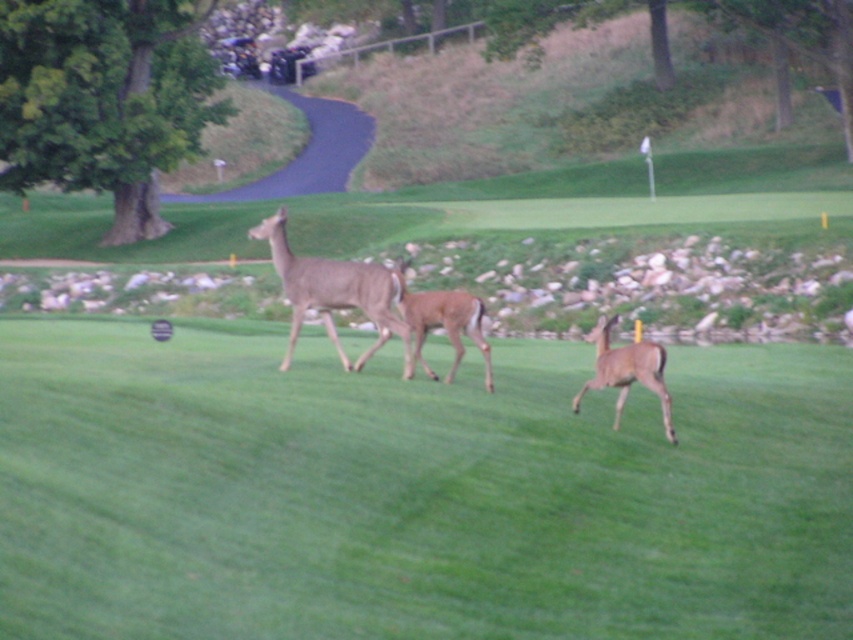
Between green grass at center and brown matte deer at center, which one is positioned lower?

green grass at center

This screenshot has height=640, width=853. What do you see at coordinates (412, 492) in the screenshot?
I see `green grass at center` at bounding box center [412, 492].

This screenshot has width=853, height=640. I want to click on green grass at center, so click(412, 492).

At what (x,y) coordinates should I click in order to perform the action: click on green grass at center. Please return your answer as a coordinate pair (x, y). Looking at the image, I should click on tap(412, 492).

Between green grass at center and brown fur deer at center, which one has more height?

With more height is brown fur deer at center.

What do you see at coordinates (412, 492) in the screenshot? This screenshot has width=853, height=640. I see `green grass at center` at bounding box center [412, 492].

The image size is (853, 640). I want to click on green grass at center, so click(412, 492).

Consider the image. Is brown fur deer at center to the left of brown matte deer at center from the viewer's perspective?

Yes, brown fur deer at center is to the left of brown matte deer at center.

Does brown fur deer at center appear on the right side of brown matte deer at center?

No, brown fur deer at center is not to the right of brown matte deer at center.

Find the location of a particular element. brown fur deer at center is located at coordinates (334, 292).

The height and width of the screenshot is (640, 853). Find the location of `brown fur deer at center`. brown fur deer at center is located at coordinates (334, 292).